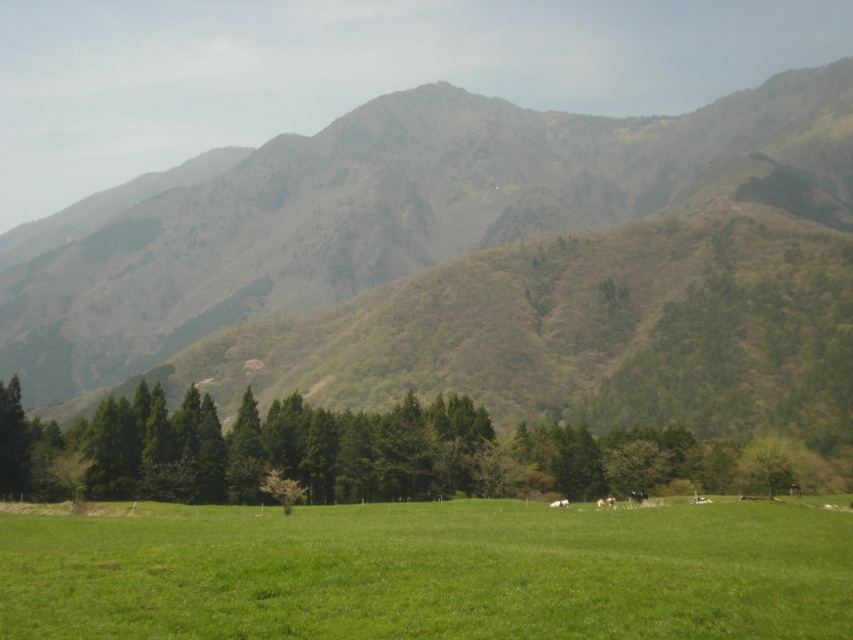
From the picture: Can you confirm if green grassy hillside at center is taller than green grass pasture at center?

Indeed, green grassy hillside at center has a greater height compared to green grass pasture at center.

Is green grassy hillside at center positioned at the back of green grass pasture at center?

Yes, it is.

Locate an element on the screen. This screenshot has height=640, width=853. green grassy hillside at center is located at coordinates (486, 266).

Does green grass pasture at center have a greater width compared to green textured trees at center?

Incorrect, green grass pasture at center's width does not surpass green textured trees at center's.

Can you confirm if green grass pasture at center is bigger than green textured trees at center?

No, green grass pasture at center is not bigger than green textured trees at center.

Is point (537, 532) positioned after point (509, 444)?

No, it is not.

You are a GUI agent. You are given a task and a screenshot of the screen. Output one action in this format:
    pyautogui.click(x=<x>, y=<y>)
    Task: Click on the green grass pasture at center
    Image resolution: width=853 pixels, height=640 pixels.
    Given the screenshot: What is the action you would take?
    pyautogui.click(x=431, y=572)

The height and width of the screenshot is (640, 853). I want to click on green grassy hillside at center, so click(486, 266).

Is green grassy hillside at center shorter than green textured trees at center?

In fact, green grassy hillside at center may be taller than green textured trees at center.

Locate an element on the screen. The width and height of the screenshot is (853, 640). green grassy hillside at center is located at coordinates (486, 266).

Locate an element on the screen. green grassy hillside at center is located at coordinates (486, 266).